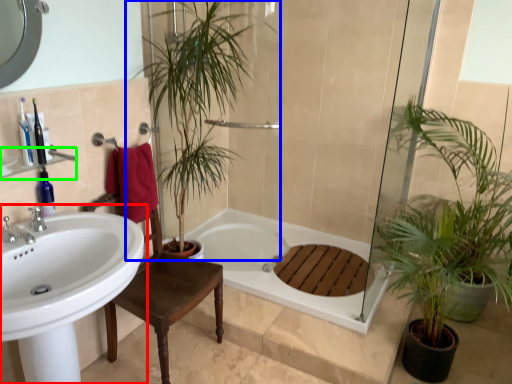
Question: Considering the real-world distances, which object is farthest from sink (highlighted by a red box)? houseplant (highlighted by a blue box) or balustrade (highlighted by a green box)?

Choices:
 (A) houseplant
 (B) balustrade

Answer: (A)